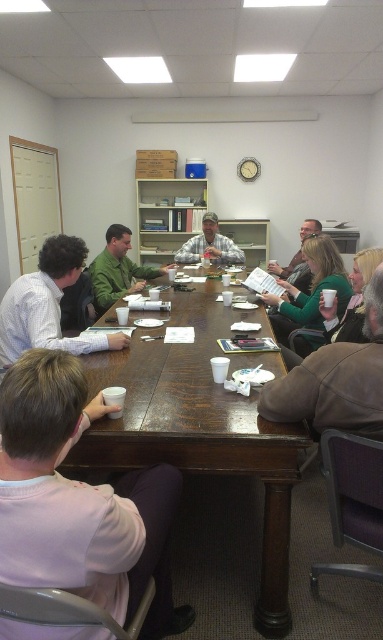
Question: Among these objects, which one is farthest from the camera?

Choices:
 (A) green matte shirt at center
 (B) matte gray shirt at upper center

Answer: (B)

Question: Based on their relative distances, which object is nearer to the green matte shirt at center?

Choices:
 (A) brown leather jacket at lower right
 (B) white shirt at left

Answer: (B)

Question: Which point is farther to the camera?

Choices:
 (A) (309, 381)
 (B) (302, 224)
 (C) (104, 264)
 (D) (286, 280)

Answer: (B)

Question: Is brown leather jacket at lower right closer to the viewer compared to matte green sweater at center?

Choices:
 (A) no
 (B) yes

Answer: (B)

Question: Is green matte shirt at center further to the viewer compared to plaid flannel shirt at center?

Choices:
 (A) yes
 (B) no

Answer: (B)

Question: Considering the relative positions of brown leather jacket at lower right and plaid flannel shirt at center in the image provided, where is brown leather jacket at lower right located with respect to plaid flannel shirt at center?

Choices:
 (A) above
 (B) below

Answer: (B)